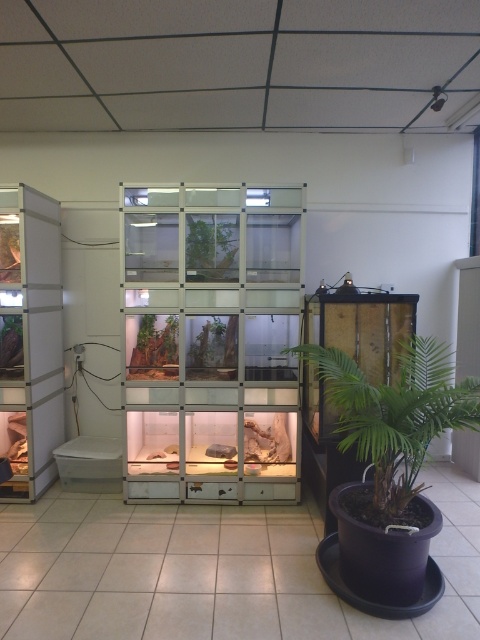
Question: Which object is farther from the camera taking this photo?

Choices:
 (A) green leafy plant at lower right
 (B) green matte plant at center

Answer: (B)

Question: In this image, where is green leafy plant at lower right located relative to green matte plant at center?

Choices:
 (A) right
 (B) left

Answer: (A)

Question: Can you confirm if green leafy plant at lower right is positioned below green matte plant at center?

Choices:
 (A) no
 (B) yes

Answer: (B)

Question: Is green leafy plant at lower right smaller than green matte plant at center?

Choices:
 (A) yes
 (B) no

Answer: (B)

Question: Which object appears farthest from the camera in this image?

Choices:
 (A) green leafy plant at lower right
 (B) green matte plant at center

Answer: (B)